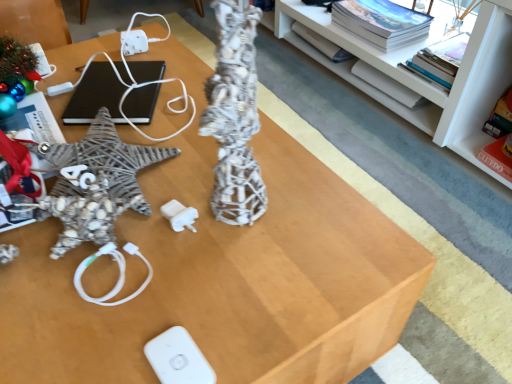
Image resolution: width=512 pixels, height=384 pixels. Find the location of `vacant region to the right of black matte laptop at upper left`. vacant region to the right of black matte laptop at upper left is located at coordinates (182, 97).